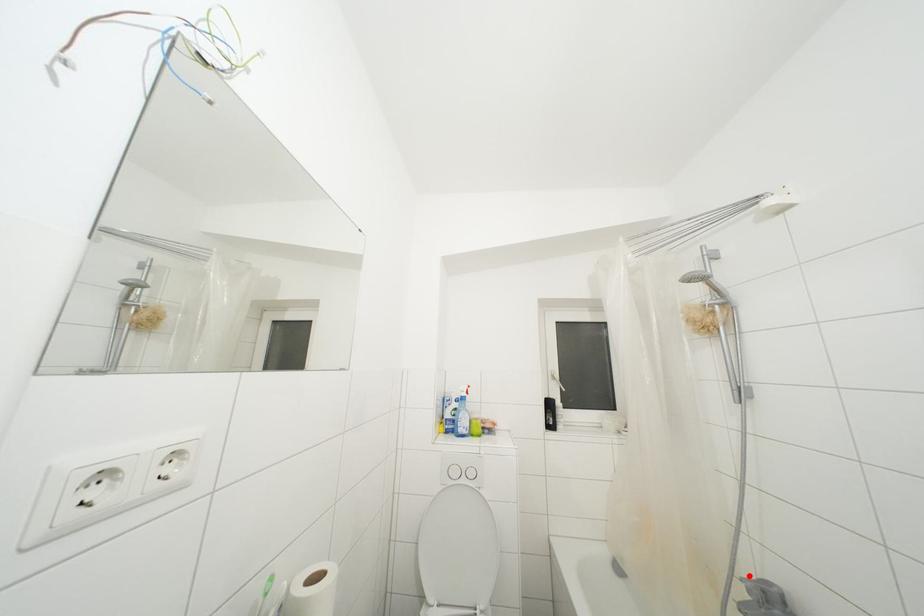
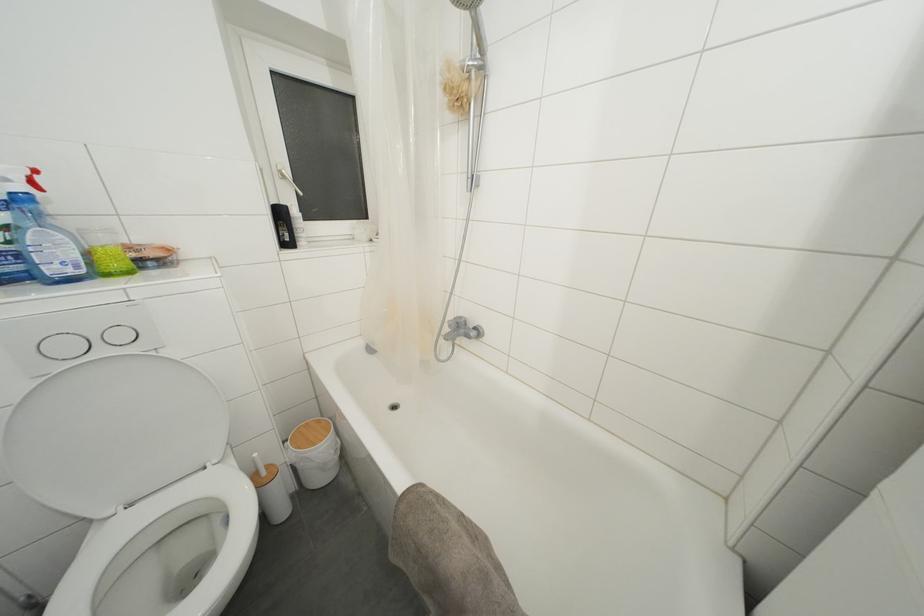
Question: A red point is marked in image1. In image2, is the corresponding 3D point closer to the camera or farther? Reply with the corresponding letter.

Choices:
 (A) The corresponding 3D point is closer.
 (B) The corresponding 3D point is farther.

Answer: (B)